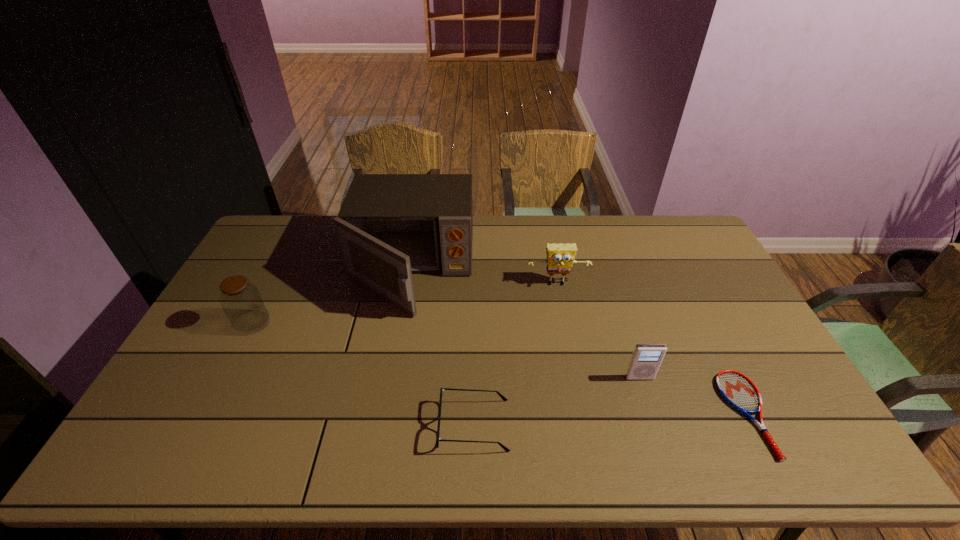
The image size is (960, 540). I want to click on the tallest object, so click(x=389, y=226).

Where is `the leftmost object`? Image resolution: width=960 pixels, height=540 pixels. the leftmost object is located at coordinates (241, 301).

You are a GUI agent. You are given a task and a screenshot of the screen. Output one action in this format:
    pyautogui.click(x=<x>, y=<y>)
    Task: Click on the sponge
    Image resolution: width=960 pixels, height=540 pixels.
    Given the screenshot: What is the action you would take?
    pyautogui.click(x=560, y=257)

Locate an element on the screen. iPod is located at coordinates (646, 359).

Image resolution: width=960 pixels, height=540 pixels. I want to click on the second shortest object, so click(x=506, y=449).

Where is `tennis racket`? The height and width of the screenshot is (540, 960). tennis racket is located at coordinates (736, 389).

Locate an element on the screen. the shortest object is located at coordinates (736, 389).

In order to click on vacant area located 0.310m with the door open on the front of the tallest object in this screenshot , I will do `click(386, 411)`.

You are a GUI agent. You are given a task and a screenshot of the screen. Output one action in this format:
    pyautogui.click(x=<x>, y=<y>)
    Task: Click on the vacant space positioned on the left of the jar
    The image size is (960, 540).
    Given the screenshot: What is the action you would take?
    pyautogui.click(x=209, y=323)

Locate an element on the screen. This screenshot has height=540, width=960. free space located on the face of the fourth object from left to right is located at coordinates (574, 374).